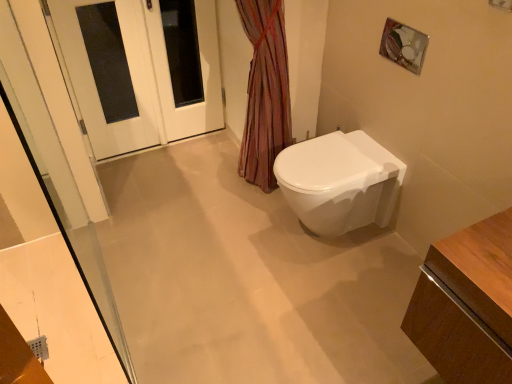
Question: Is white glossy door at upper left in front of white glossy door at upper left?

Choices:
 (A) yes
 (B) no

Answer: (A)

Question: From a real-world perspective, is white glossy door at upper left over white glossy door at upper left?

Choices:
 (A) yes
 (B) no

Answer: (A)

Question: Is white glossy door at upper left thinner than white glossy door at upper left?

Choices:
 (A) yes
 (B) no

Answer: (A)

Question: Can you confirm if white glossy door at upper left is shorter than white glossy door at upper left?

Choices:
 (A) no
 (B) yes

Answer: (A)

Question: Considering the relative sizes of white glossy door at upper left and white glossy door at upper left in the image provided, is white glossy door at upper left taller than white glossy door at upper left?

Choices:
 (A) yes
 (B) no

Answer: (A)

Question: Considering the relative positions of white glossy door at upper left and white glossy toilet at center-right in the image provided, is white glossy door at upper left to the left or to the right of white glossy toilet at center-right?

Choices:
 (A) left
 (B) right

Answer: (A)

Question: Is white glossy door at upper left wider or thinner than white glossy toilet at center-right?

Choices:
 (A) wide
 (B) thin

Answer: (B)

Question: From a real-world perspective, is white glossy door at upper left positioned above or below white glossy toilet at center-right?

Choices:
 (A) below
 (B) above

Answer: (B)

Question: Is point (214, 26) positioned closer to the camera than point (371, 193)?

Choices:
 (A) closer
 (B) farther

Answer: (B)

Question: Is point (202, 81) positioned closer to the camera than point (214, 21)?

Choices:
 (A) closer
 (B) farther

Answer: (B)

Question: Considering the positions of white glossy door at upper left and white glossy door at upper left in the image, is white glossy door at upper left wider or thinner than white glossy door at upper left?

Choices:
 (A) thin
 (B) wide

Answer: (A)

Question: From a real-world perspective, is white glossy door at upper left positioned above or below white glossy door at upper left?

Choices:
 (A) above
 (B) below

Answer: (A)

Question: Looking at the image, does white glossy door at upper left seem bigger or smaller compared to white glossy door at upper left?

Choices:
 (A) big
 (B) small

Answer: (A)

Question: In the image, is white glossy toilet at center-right on the left side or the right side of white glossy door at upper left?

Choices:
 (A) left
 (B) right

Answer: (B)

Question: Considering the positions of white glossy toilet at center-right and white glossy door at upper left in the image, is white glossy toilet at center-right bigger or smaller than white glossy door at upper left?

Choices:
 (A) big
 (B) small

Answer: (A)